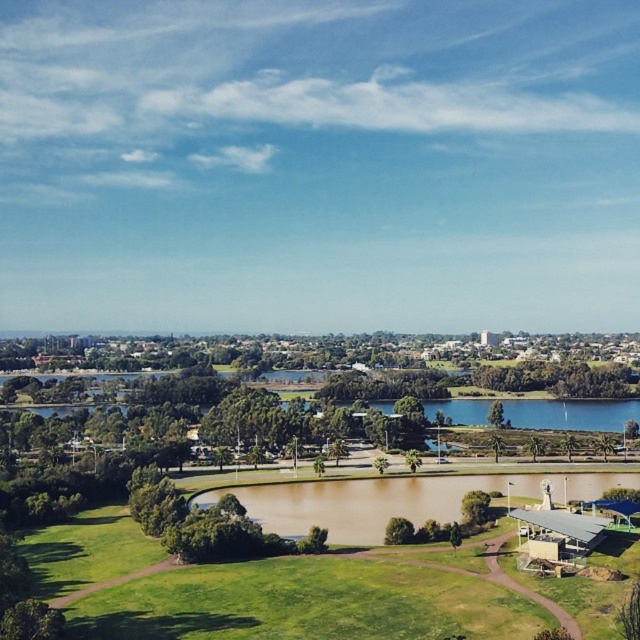
Who is taller, green grassy golf course at lower left or brown matte water at center?

With more height is brown matte water at center.

Does green grassy golf course at lower left have a greater width compared to brown matte water at center?

Yes, green grassy golf course at lower left is wider than brown matte water at center.

Which is behind, point (502, 483) or point (378, 483)?

The point (378, 483) is more distant.

Identify the location of green grassy golf course at lower left. (301, 604).